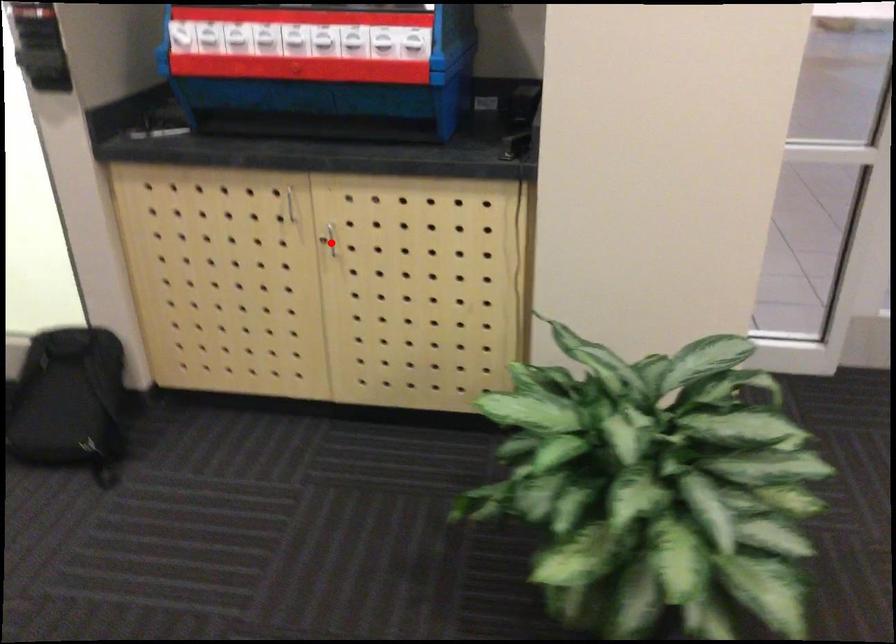
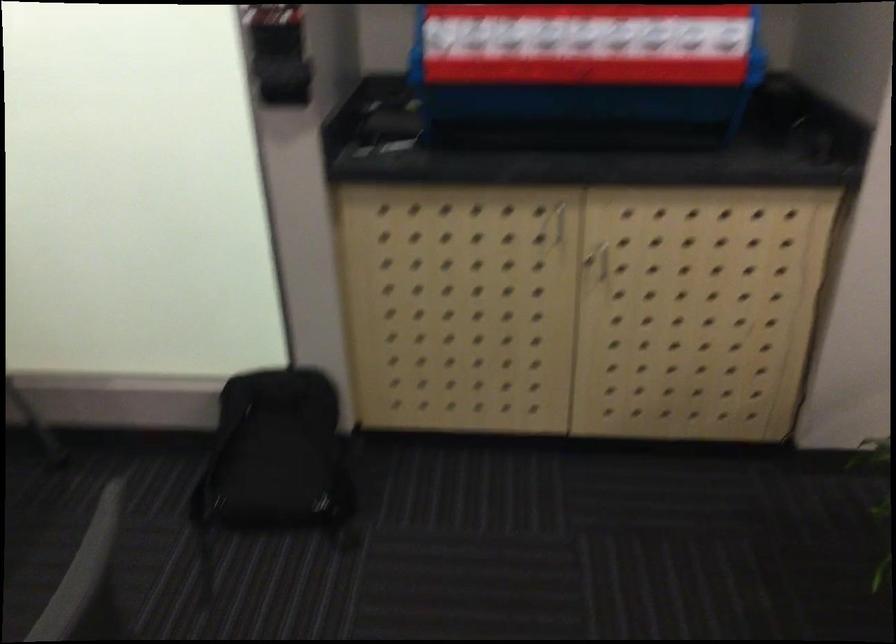
In the second image, find the point that corresponds to the highlighted location in the first image.

(604, 261)